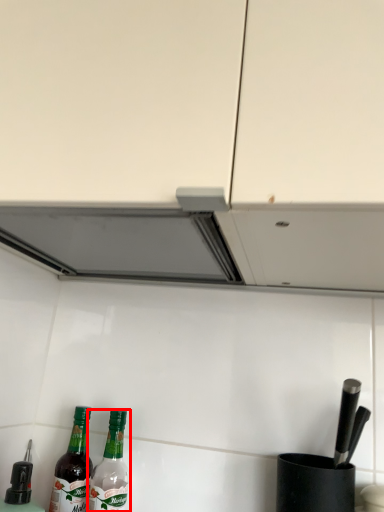
Question: Considering the relative positions of bottle (annotated by the red box) and bottle in the image provided, where is bottle (annotated by the red box) located with respect to the staircase?

Choices:
 (A) left
 (B) right

Answer: (B)